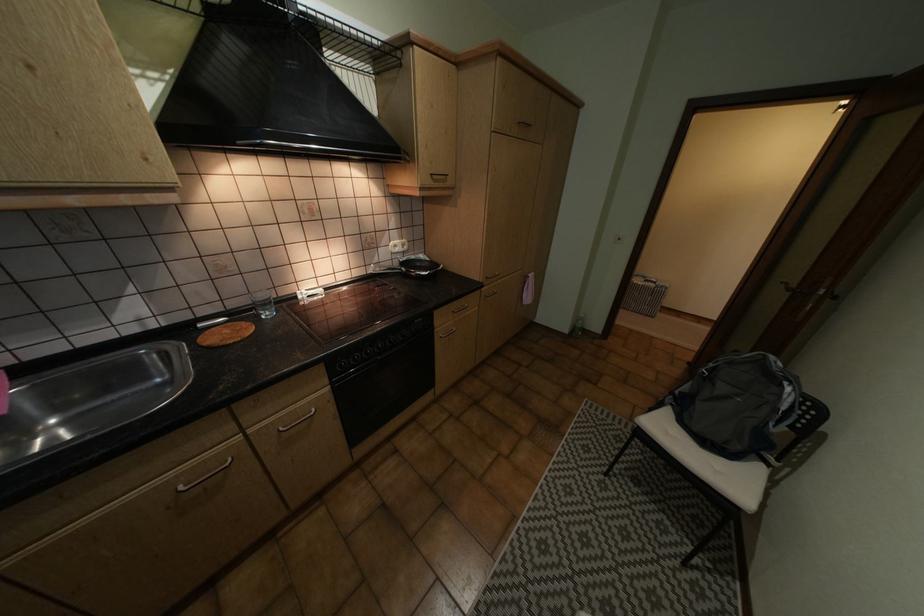
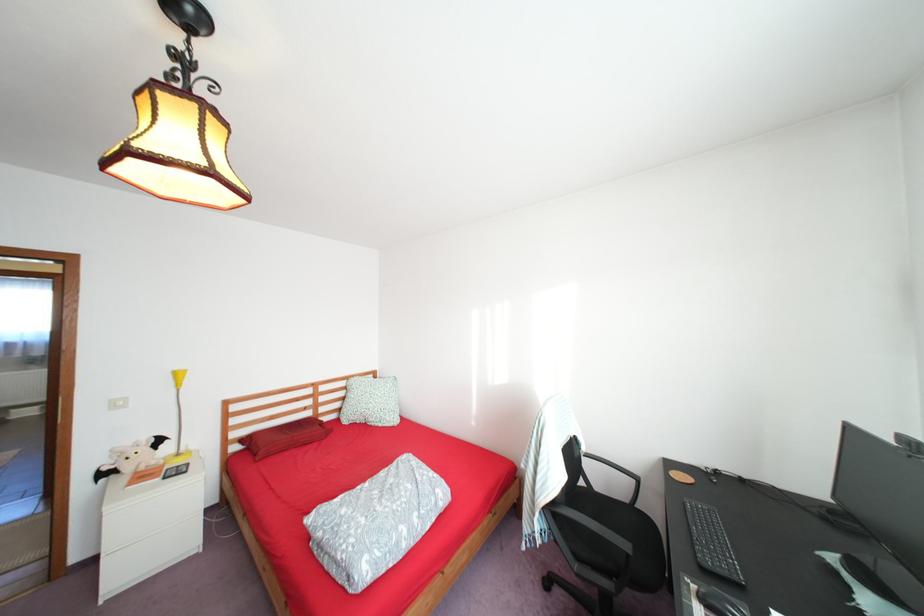
Question: I am providing you with two images of the same scene from different viewpoints. Which of the following objects are not visible in image2?

Choices:
 (A) yellow table lamp
 (B) clear glass cup
 (C) brown cabinet knob
 (D) black computer mouse

Answer: (B)